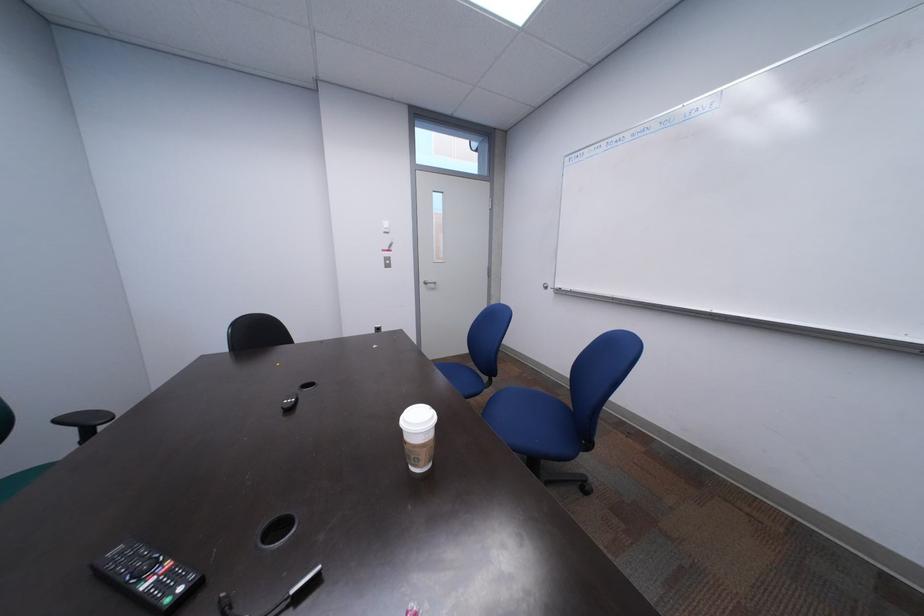
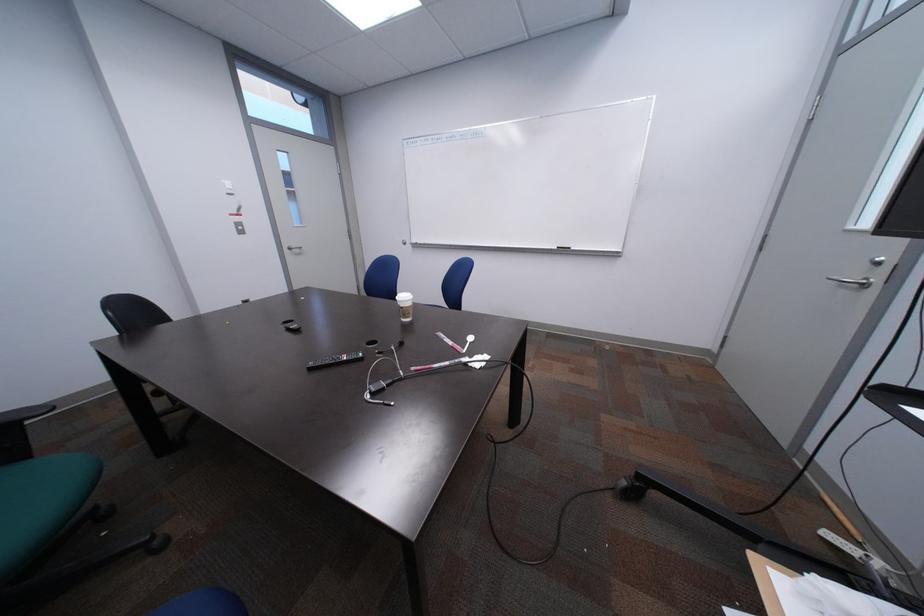
Question: How did the camera likely rotate?

Choices:
 (A) Left
 (B) Right
 (C) Up
 (D) Down

Answer: (B)